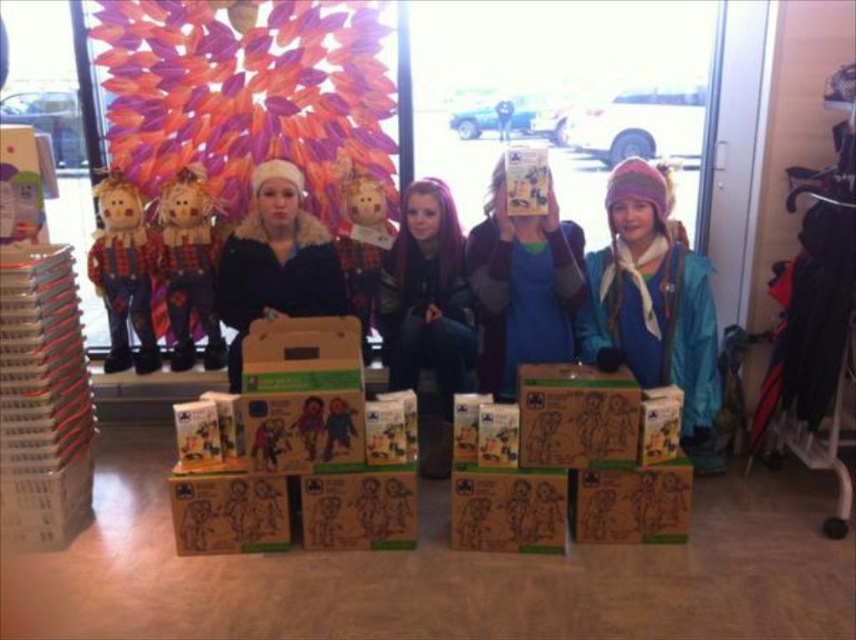
Question: Is transparent glass shop window at center wider than dark purple hair at center?

Choices:
 (A) yes
 (B) no

Answer: (A)

Question: Considering the real-world distances, which object is closest to the wooden scarecrow at center?

Choices:
 (A) blue matte shirt at center
 (B) plush fabric scarecrow at left
 (C) blue fleece jacket at center

Answer: (A)

Question: Among these objects, which one is nearest to the camera?

Choices:
 (A) blue matte shirt at center
 (B) transparent glass shop window at center
 (C) dark purple hair at center
 (D) blue fleece jacket at center

Answer: (A)

Question: Observing the image, what is the correct spatial positioning of transparent glass shop window at center in reference to dark purple hair at center?

Choices:
 (A) right
 (B) left

Answer: (B)

Question: Which point is farther to the camera?

Choices:
 (A) matte black jacket at center
 (B) blue matte shirt at center
 (C) dark purple hair at center

Answer: (A)

Question: Where is transparent glass shop window at center located in relation to matte black jacket at center in the image?

Choices:
 (A) left
 (B) right

Answer: (B)